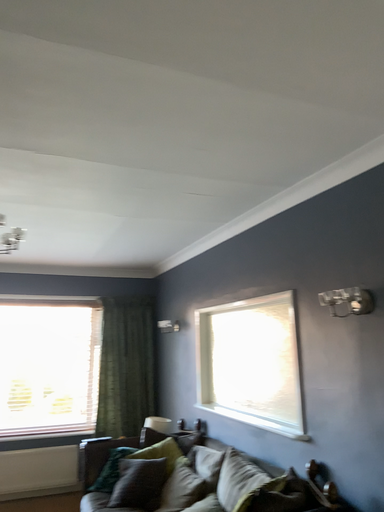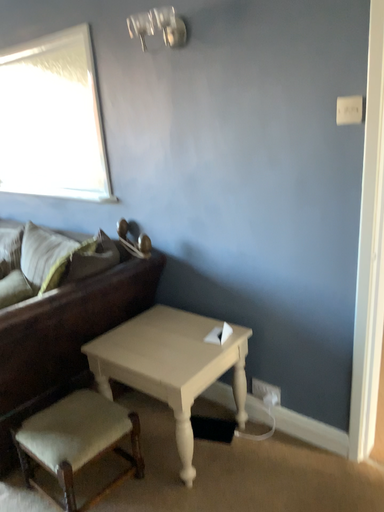
Question: Which way did the camera rotate in the video?

Choices:
 (A) rotated left
 (B) rotated right

Answer: (B)